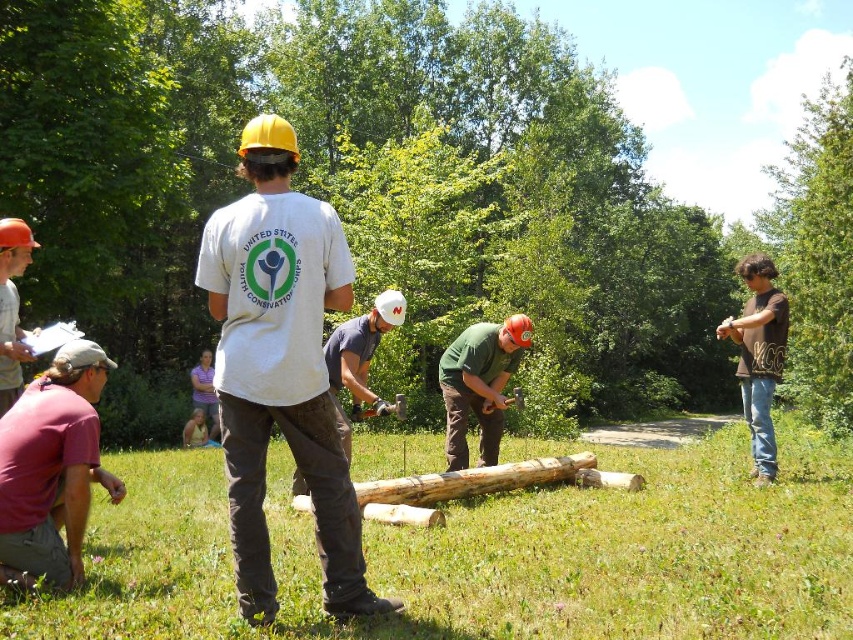
You are a photographer trying to capture a clear photo of both the dark gray cotton shirt at center and the matte orange hard hat at left. Since you want both objects to appear roughly the same size in your photo, which direction should you move your camera? Explain your reasoning.

The dark gray cotton shirt at center is bigger than the matte orange hard hat at left. To make them appear the same size in the photo, you should move the camera closer to the matte orange hard hat at left and farther from the dark gray cotton shirt at center. This adjustment balances their sizes in the frame.